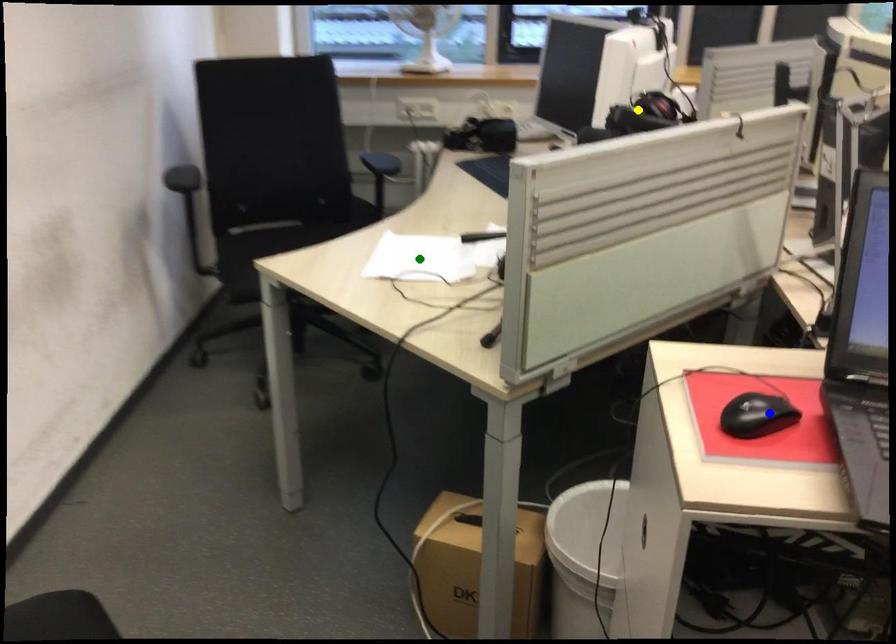
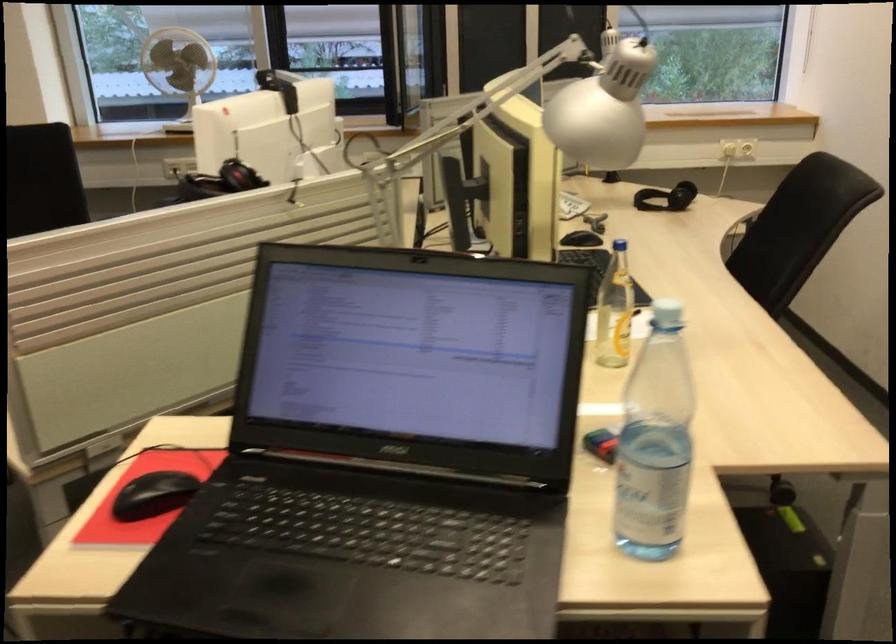
I am providing you with two images of the same scene from different viewpoints. Three points are marked in image1. Which point corresponds to a part or object that is occluded in image2?In image1, three points are marked. Which of them correspond to a part or object that is occluded in image2?Among the three points shown in image1, which one corresponds to a part or object that is no longer visible due to occlusion in image2?

green point